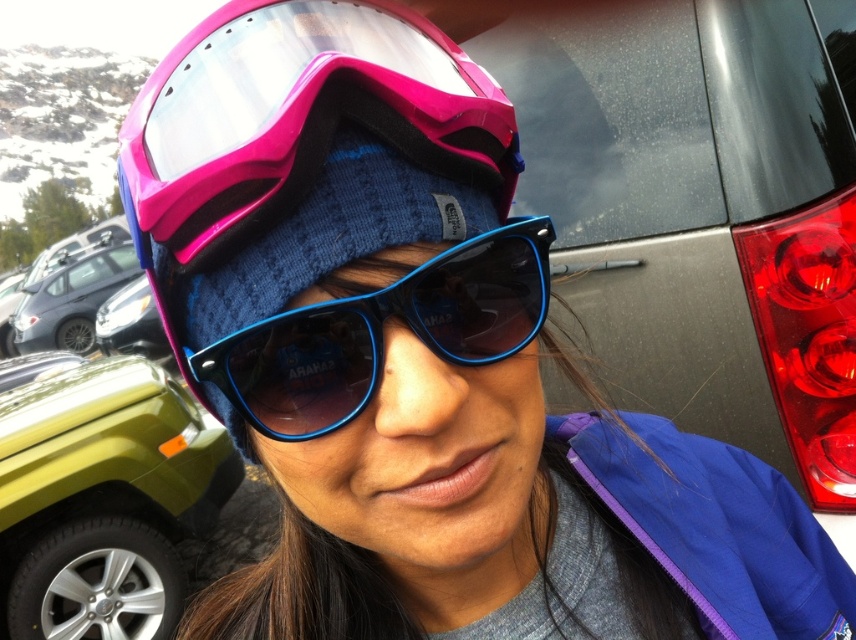
Question: Does green matte jeep at lower left appear on the right side of blue plastic sunglasses at center?

Choices:
 (A) yes
 (B) no

Answer: (B)

Question: Which point is farther to the camera?

Choices:
 (A) blue plastic sunglasses at center
 (B) green matte jeep at lower left

Answer: (B)

Question: Which of the following is the farthest from the observer?

Choices:
 (A) (226, 452)
 (B) (251, 381)

Answer: (A)

Question: Can you confirm if green matte jeep at lower left is smaller than blue plastic sunglasses at center?

Choices:
 (A) yes
 (B) no

Answer: (B)

Question: Does green matte jeep at lower left appear on the left side of blue plastic sunglasses at center?

Choices:
 (A) no
 (B) yes

Answer: (B)